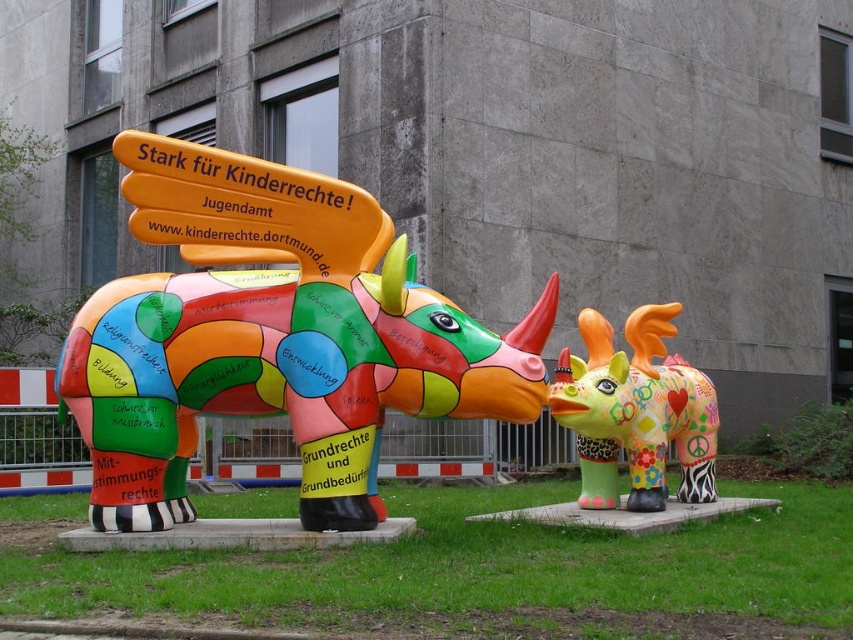
Can you confirm if green grass at lower center is smaller than multicolored painted rhino at center?

Yes.

Consider the image. Does green grass at lower center appear over multicolored painted rhino at center?

No, green grass at lower center is not above multicolored painted rhino at center.

In order to click on green grass at lower center in this screenshot , I will do `click(471, 570)`.

Between point (334, 316) and point (665, 406), which one is positioned in front?

Point (334, 316)

Can you confirm if multicolored painted rhinoceros at center is taller than multicolored painted rhino at center?

Yes, multicolored painted rhinoceros at center is taller than multicolored painted rhino at center.

Which is behind, point (404, 234) or point (657, 316)?

Positioned behind is point (404, 234).

You are a GUI agent. You are given a task and a screenshot of the screen. Output one action in this format:
    pyautogui.click(x=<x>, y=<y>)
    Task: Click on the multicolored painted rhinoceros at center
    Image resolution: width=853 pixels, height=640 pixels.
    Given the screenshot: What is the action you would take?
    pyautogui.click(x=271, y=337)

Is point (390, 346) behind point (590, 604)?

Yes, it is behind point (590, 604).

Which is in front, point (183, 300) or point (428, 573)?

Point (428, 573) is more forward.

This screenshot has height=640, width=853. In order to click on multicolored painted rhinoceros at center in this screenshot , I will do (271, 337).